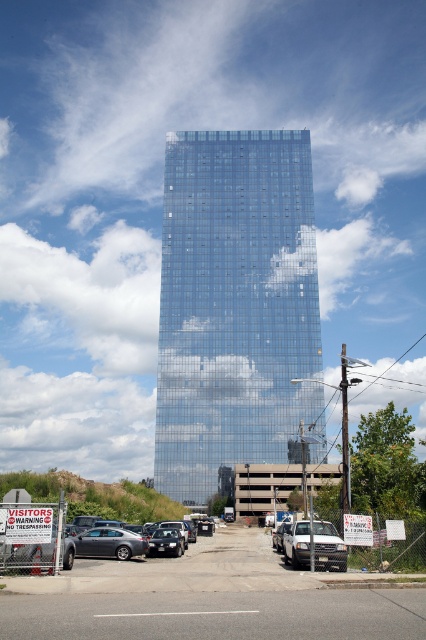
Question: Is matte gray sedan at center above silver metallic truck at center?

Choices:
 (A) no
 (B) yes

Answer: (A)

Question: Which point is closer to the camera?

Choices:
 (A) silver metallic truck at center
 (B) glossy glass building at center
 (C) gray asphalt parking lot at lower center
 (D) satin black sedan at center

Answer: (C)

Question: Which object is farther from the camera taking this photo?

Choices:
 (A) satin black sedan at center
 (B) gray asphalt parking lot at lower center
 (C) glossy glass building at center

Answer: (C)

Question: Which point is farther to the camera?

Choices:
 (A) (140, 548)
 (B) (189, 456)

Answer: (B)

Question: Is silver metallic truck at center smaller than satin silver car at lower left?

Choices:
 (A) yes
 (B) no

Answer: (A)

Question: Is gray asphalt parking lot at lower center below silver metallic truck at center?

Choices:
 (A) no
 (B) yes

Answer: (B)